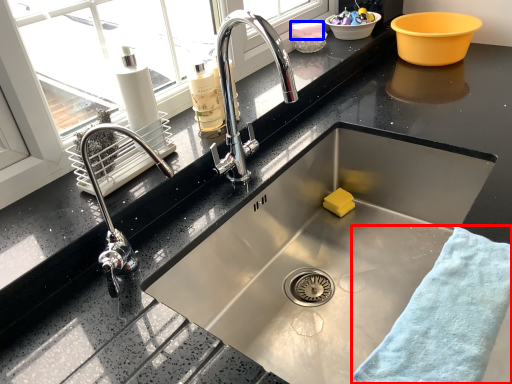
Question: Which point is closer to the camera, bath towel (highlighted by a red box) or basin (highlighted by a blue box)?

Choices:
 (A) bath towel
 (B) basin

Answer: (A)